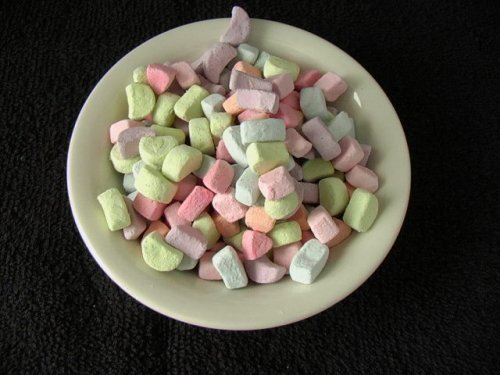
You are a GUI agent. You are given a task and a screenshot of the screen. Output one action in this format:
    pyautogui.click(x=<x>, y=<y>)
    Task: Click on the dark grain in wood
    
    Given the screenshot: What is the action you would take?
    pyautogui.click(x=31, y=308), pyautogui.click(x=72, y=322), pyautogui.click(x=65, y=284)